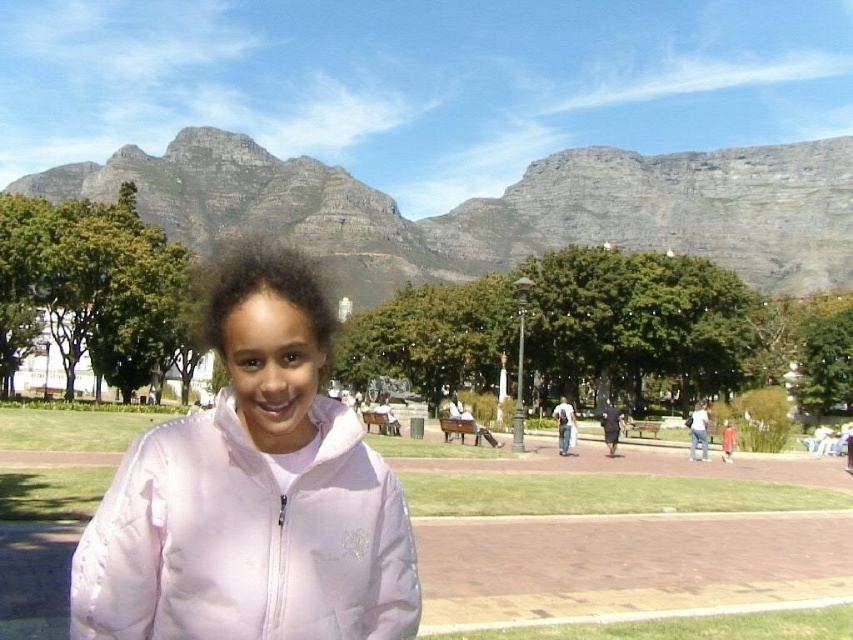
You are an artist planning to sketch this scene. You want to ensure that the pink quilted jacket at center and the rocky gray mountain at upper center are both visible but want to emphasize the mountain. Based on their sizes, how should you adjust your drawing?

The pink quilted jacket at center occupies less space than the rocky gray mountain at upper center, so to emphasize the mountain, you can maintain the mountain at its current size and reduce the size of the pink quilted jacket at center slightly in your sketch.

You are standing at point (x=393, y=269) and want to walk to the park entrance located at point (x=309, y=429). According to the scene, will you be moving towards the mountains or away from them?

Point (x=309, y=429) is in front of point (x=393, y=269), so moving from point (x=393, y=269) to point (x=309, y=429) means you are moving towards the mountains.

You are standing at the point labeled point (242, 321) in the image. A friend is standing exactly 34.82 meters away from you. Can you estimate how far your friend is from the tall lamppost near the center of the frame?

The friend is 34.82 meters away from you at point (242, 321). However, without knowing the exact position of the tall lamppost near the center of the frame relative to your location, it is impossible to determine the distance between your friend and the lamppost.